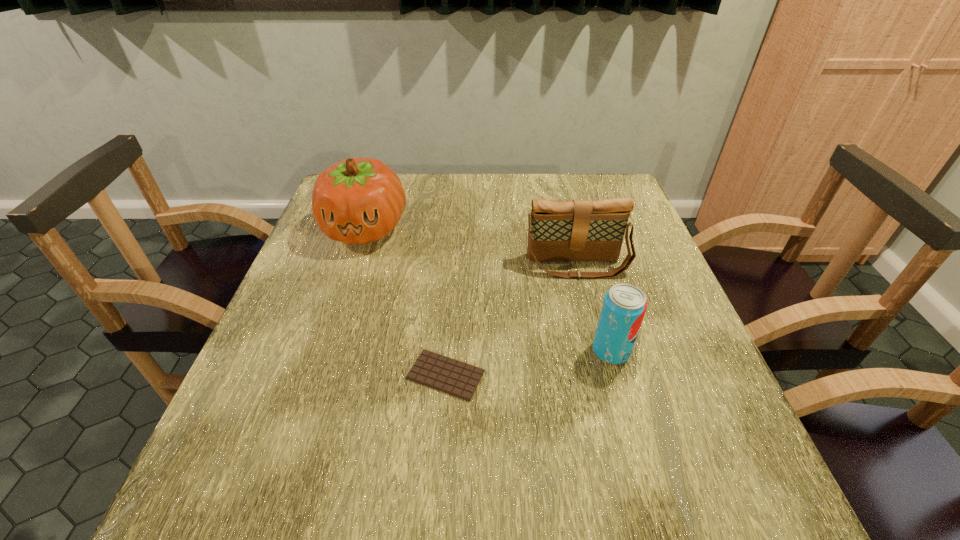
Identify which object is located as the second nearest to the third object from right to left. Please provide its 2D coordinates. Your answer should be formatted as a tuple, i.e. [(x, y)], where the tuple contains the x and y coordinates of a point satisfying the conditions above.

[(579, 230)]

At what (x,y) coordinates should I click in order to perform the action: click on object identified as the closest to the chocolate bar. Please return your answer as a coordinate pair (x, y). Image resolution: width=960 pixels, height=540 pixels. Looking at the image, I should click on (624, 306).

I want to click on vacant space that satisfies the following two spatial constraints: 1. on the side of the leftmost object with the cute face; 2. on the right side of the soda can, so click(x=325, y=350).

Identify the location of free region that satisfies the following two spatial constraints: 1. on the side of the shortest object with the cute face; 2. on the right side of the leftmost object. This screenshot has width=960, height=540. (317, 375).

Where is `free space that satisfies the following two spatial constraints: 1. on the side of the soda can with the cute face; 2. on the right side of the leftmost object`? free space that satisfies the following two spatial constraints: 1. on the side of the soda can with the cute face; 2. on the right side of the leftmost object is located at coordinates (325, 350).

The width and height of the screenshot is (960, 540). Identify the location of vacant area that satisfies the following two spatial constraints: 1. on the front-facing side of the soda can; 2. on the left side of the shoulder bag. (598, 350).